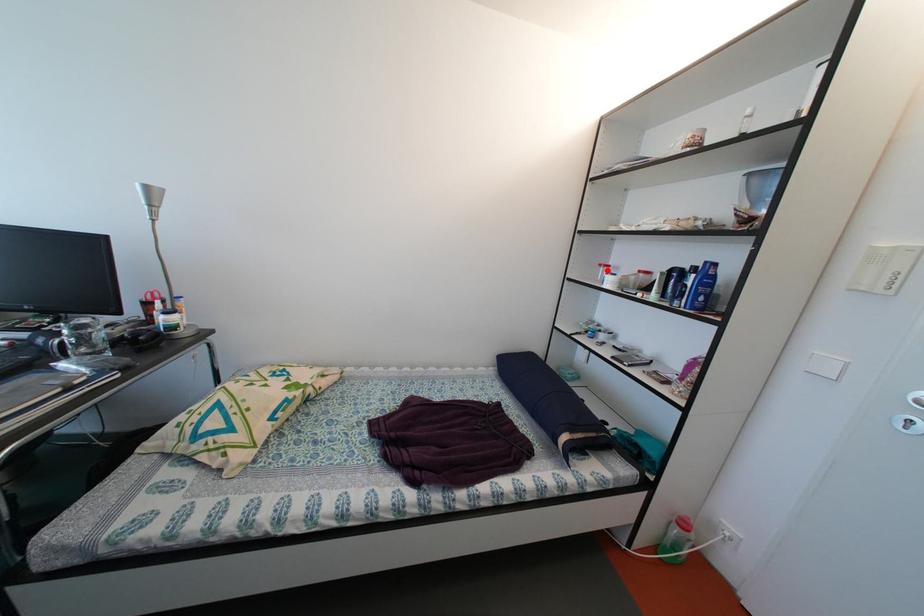
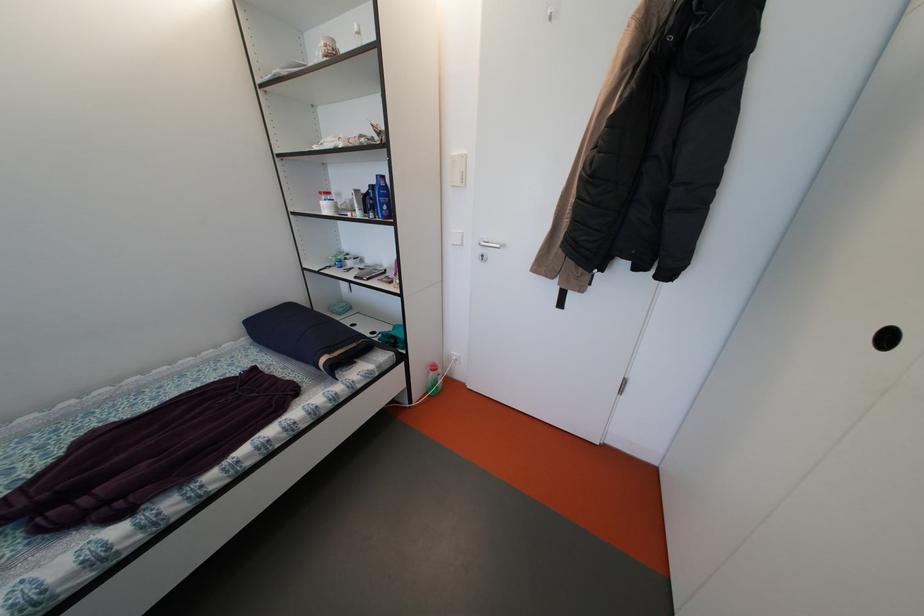
Find the pixel in the second image that matches the highlighted location in the first image.

(327, 198)